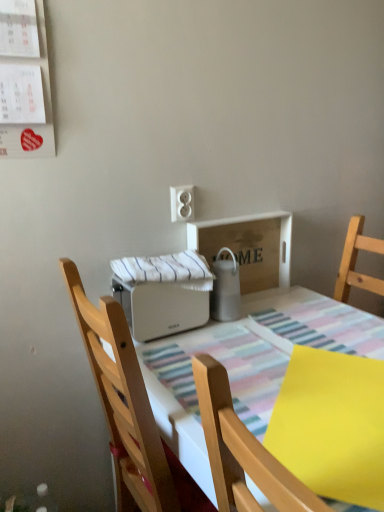
The height and width of the screenshot is (512, 384). I want to click on free area in between white matte toaster at center, arranged as the first appliance when viewed from the left, and yellow matte paper at lower right, so click(x=227, y=360).